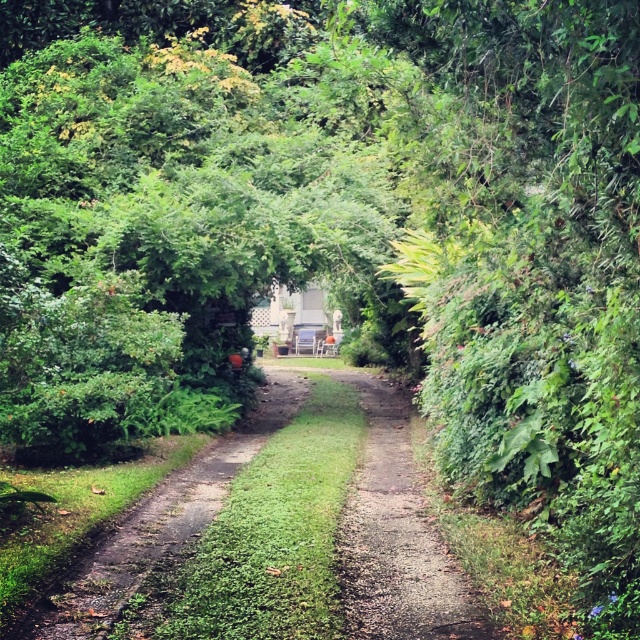
Question: Can you confirm if dirt path at center is thinner than green grassy trail at center?

Choices:
 (A) yes
 (B) no

Answer: (A)

Question: Is dirt path at center to the right of green grassy trail at center from the viewer's perspective?

Choices:
 (A) no
 (B) yes

Answer: (B)

Question: Can you confirm if dirt path at center is positioned above green grassy trail at center?

Choices:
 (A) yes
 (B) no

Answer: (B)

Question: Which point is closer to the camera?

Choices:
 (A) (35, 605)
 (B) (372, 584)

Answer: (A)